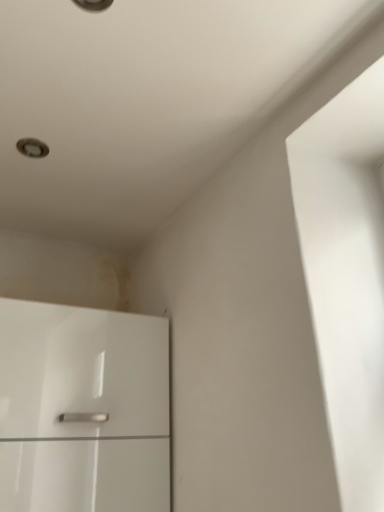
This screenshot has width=384, height=512. What do you see at coordinates (32, 148) in the screenshot?
I see `matte silver light fixture at upper left` at bounding box center [32, 148].

This screenshot has height=512, width=384. I want to click on matte silver light fixture at upper left, so click(32, 148).

What do you see at coordinates (83, 409) in the screenshot?
I see `glossy white cabinet at lower left` at bounding box center [83, 409].

Identify the location of glossy white cabinet at lower left. The image size is (384, 512). (83, 409).

At what (x,y) coordinates should I click in order to perform the action: click on matte silver light fixture at upper left. Please return your answer as a coordinate pair (x, y). The image size is (384, 512). Looking at the image, I should click on (32, 148).

In the image, is glossy white cabinet at lower left on the left side or the right side of matte silver light fixture at upper left?

glossy white cabinet at lower left is positioned on matte silver light fixture at upper left's right side.

From the picture: Is glossy white cabinet at lower left in front of or behind matte silver light fixture at upper left in the image?

Clearly, glossy white cabinet at lower left is in front of matte silver light fixture at upper left.

Which point is more distant from viewer, (x=13, y=482) or (x=34, y=155)?

Point (x=34, y=155)

From the image's perspective, is glossy white cabinet at lower left located above or below matte silver light fixture at upper left?

From the image's perspective, glossy white cabinet at lower left appears below matte silver light fixture at upper left.

From a real-world perspective, is glossy white cabinet at lower left over matte silver light fixture at upper left?

Incorrect, from a real-world perspective, glossy white cabinet at lower left is lower than matte silver light fixture at upper left.

Is glossy white cabinet at lower left thinner than matte silver light fixture at upper left?

No.

Is glossy white cabinet at lower left shorter than matte silver light fixture at upper left?

No, glossy white cabinet at lower left is not shorter than matte silver light fixture at upper left.

Considering the sizes of objects glossy white cabinet at lower left and matte silver light fixture at upper left in the image provided, who is bigger, glossy white cabinet at lower left or matte silver light fixture at upper left?

glossy white cabinet at lower left.

Is glossy white cabinet at lower left inside or outside of matte silver light fixture at upper left?

glossy white cabinet at lower left exists outside the volume of matte silver light fixture at upper left.

In the scene shown: Are glossy white cabinet at lower left and matte silver light fixture at upper left making contact?

glossy white cabinet at lower left and matte silver light fixture at upper left are not in contact.

Is glossy white cabinet at lower left facing away from matte silver light fixture at upper left?

No, glossy white cabinet at lower left's orientation is not away from matte silver light fixture at upper left.

Locate an element on the screen. The height and width of the screenshot is (512, 384). cabinetry in front of the matte silver light fixture at upper left is located at coordinates (83, 409).

Is matte silver light fixture at upper left at the left side of glossy white cabinet at lower left?

Yes.

Considering their positions, is matte silver light fixture at upper left located in front of or behind glossy white cabinet at lower left?

In the image, matte silver light fixture at upper left appears behind glossy white cabinet at lower left.

Is point (33, 146) positioned in front of point (124, 367)?

Yes, it is in front of point (124, 367).

From the image's perspective, does matte silver light fixture at upper left appear lower than glossy white cabinet at lower left?

No, from the image's perspective, matte silver light fixture at upper left is not below glossy white cabinet at lower left.

From a real-world perspective, which is physically below, matte silver light fixture at upper left or glossy white cabinet at lower left?

From a 3D spatial view, glossy white cabinet at lower left is below.

Does matte silver light fixture at upper left have a lesser width compared to glossy white cabinet at lower left?

Yes, matte silver light fixture at upper left is thinner than glossy white cabinet at lower left.

Considering the relative sizes of matte silver light fixture at upper left and glossy white cabinet at lower left in the image provided, is matte silver light fixture at upper left shorter than glossy white cabinet at lower left?

Correct, matte silver light fixture at upper left is not as tall as glossy white cabinet at lower left.

Which of these two, matte silver light fixture at upper left or glossy white cabinet at lower left, is bigger?

glossy white cabinet at lower left.

Would you say matte silver light fixture at upper left is inside or outside glossy white cabinet at lower left?

matte silver light fixture at upper left exists outside the volume of glossy white cabinet at lower left.

Are matte silver light fixture at upper left and glossy white cabinet at lower left located far from each other?

That's not correct — matte silver light fixture at upper left is a little close to glossy white cabinet at lower left.

Is matte silver light fixture at upper left aimed at glossy white cabinet at lower left?

No, matte silver light fixture at upper left does not turn towards glossy white cabinet at lower left.

How many degrees apart are the facing directions of matte silver light fixture at upper left and glossy white cabinet at lower left?

The angle between the facing direction of matte silver light fixture at upper left and the facing direction of glossy white cabinet at lower left is 88.9 degrees.

The image size is (384, 512). I want to click on dot located above the glossy white cabinet at lower left (from the image's perspective), so click(x=32, y=148).

Locate an element on the screen. cabinetry located on the right of matte silver light fixture at upper left is located at coordinates (83, 409).

What are the coordinates of `cabinetry below the matte silver light fixture at upper left (from the image's perspective)` in the screenshot? It's located at (83, 409).